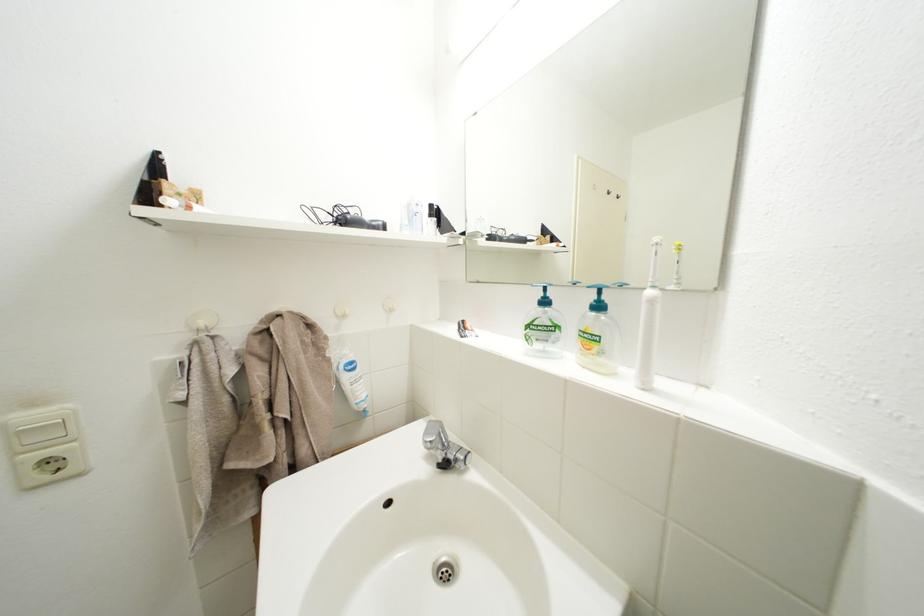
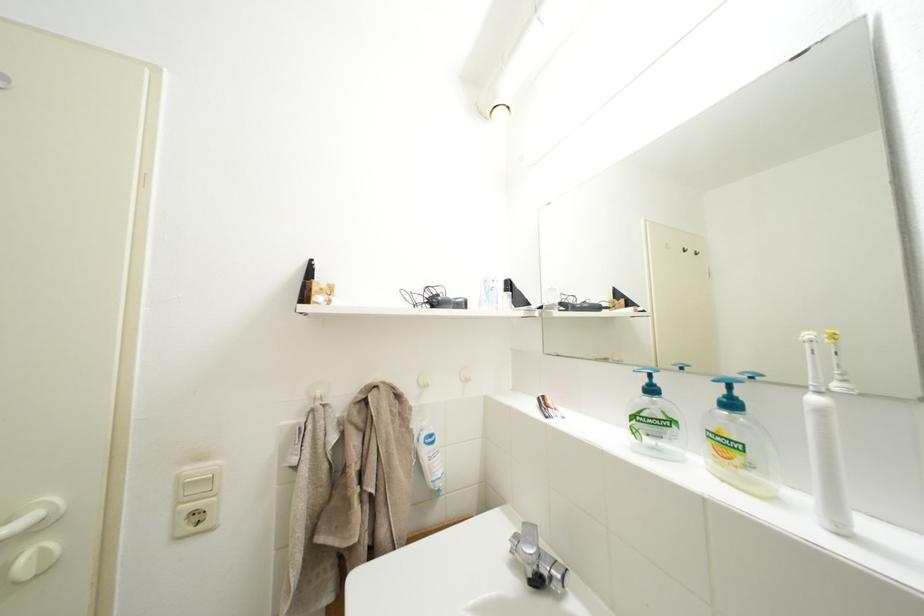
Question: The images are taken continuously from a first-person perspective. In which direction is your viewpoint rotating?

Choices:
 (A) Left
 (B) Right
 (C) Up
 (D) Down

Answer: (C)